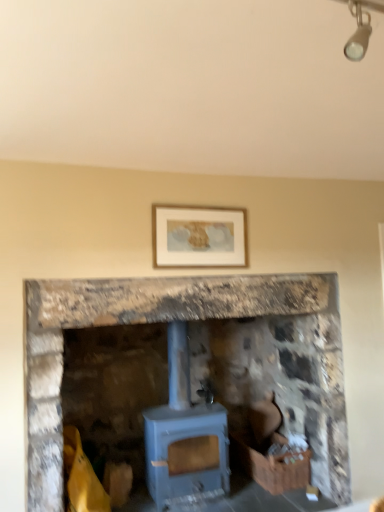
Question: Is blue stone fireplace at center bigger or smaller than blue matte wood burning stove at center?

Choices:
 (A) big
 (B) small

Answer: (A)

Question: Relative to blue matte wood burning stove at center, is blue stone fireplace at center in front or behind?

Choices:
 (A) behind
 (B) front

Answer: (B)

Question: Estimate the real-world distances between objects in this image. Which object is closer to the wooden crate at lower right?

Choices:
 (A) brown leather chair at lower right
 (B) blue matte wood burning stove at center
 (C) matte white picture frame at upper center
 (D) blue stone fireplace at center

Answer: (A)

Question: Estimate the real-world distances between objects in this image. Which object is farther from the blue matte wood burning stove at center?

Choices:
 (A) blue stone fireplace at center
 (B) brown leather chair at lower right
 (C) matte white picture frame at upper center
 (D) wooden crate at lower right

Answer: (C)